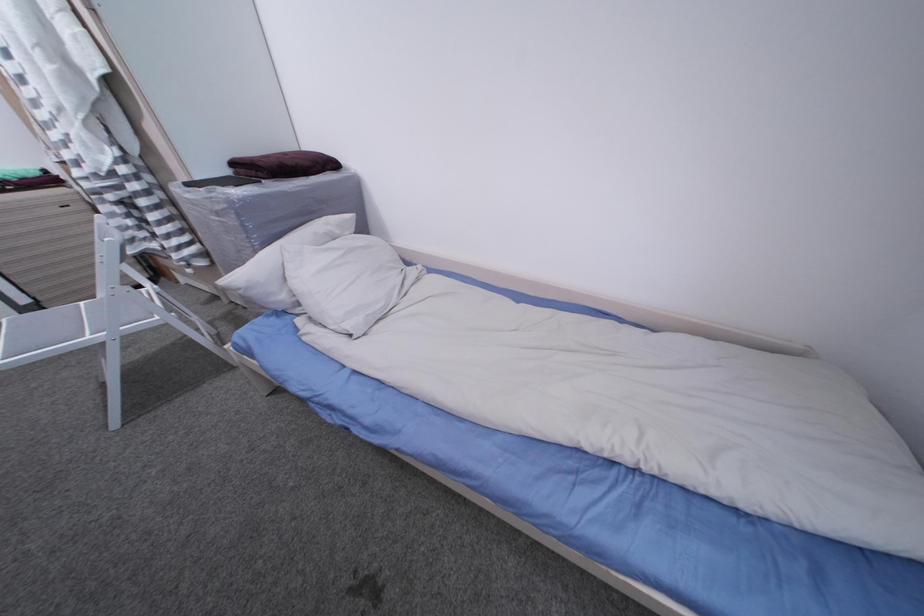
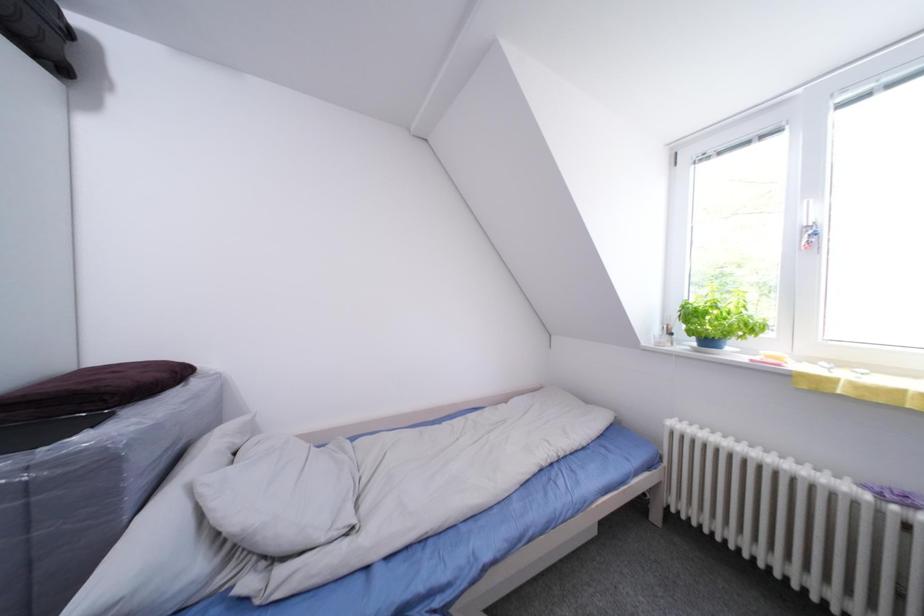
The first image is from the beginning of the video and the second image is from the end. How did the camera likely rotate when shooting the video?

The camera rotated toward right-up.